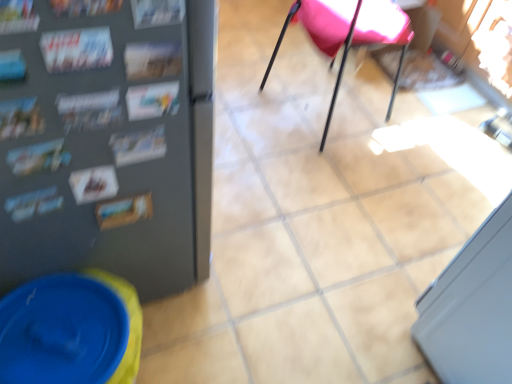
Find the location of a particular element. Image resolution: width=512 pixels, height=384 pixels. vacant space to the right of pink fabric chair at center is located at coordinates (414, 128).